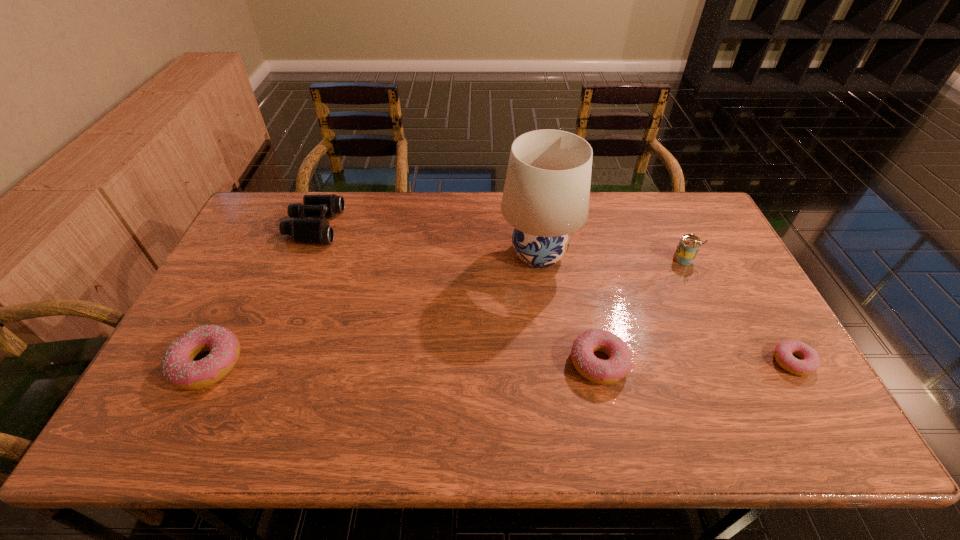
Identify the location of binoculars located in the left edge section of the desktop. This screenshot has height=540, width=960. (309, 231).

Image resolution: width=960 pixels, height=540 pixels. I want to click on doughnut located in the right edge section of the desktop, so click(x=810, y=362).

You are a GUI agent. You are given a task and a screenshot of the screen. Output one action in this format:
    pyautogui.click(x=<x>, y=<y>)
    Task: Click on the can that is at the right edge
    This screenshot has width=960, height=540.
    Given the screenshot: What is the action you would take?
    pyautogui.click(x=689, y=245)

Find the location of a particular element. object positioned at the far left corner is located at coordinates [309, 231].

What are the coordinates of `object that is positioned at the near left corner` in the screenshot? It's located at (178, 366).

Image resolution: width=960 pixels, height=540 pixels. Find the location of `object located in the near right corner section of the desktop`. object located in the near right corner section of the desktop is located at coordinates (810, 362).

Where is `vacant position at the far edge of the desktop`? This screenshot has width=960, height=540. vacant position at the far edge of the desktop is located at coordinates (648, 229).

In the image, there is a desktop. At what (x,y) coordinates should I click in order to perform the action: click on free space at the near edge. Please return your answer as a coordinate pair (x, y). Looking at the image, I should click on (476, 375).

This screenshot has width=960, height=540. In order to click on vacant space at the right edge of the desktop in this screenshot , I will do `click(749, 285)`.

Where is `free spot at the near left corner of the desktop`? free spot at the near left corner of the desktop is located at coordinates (163, 376).